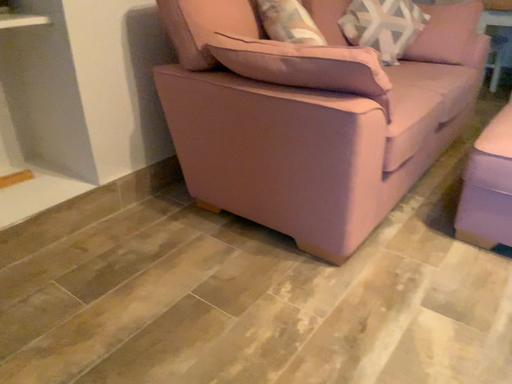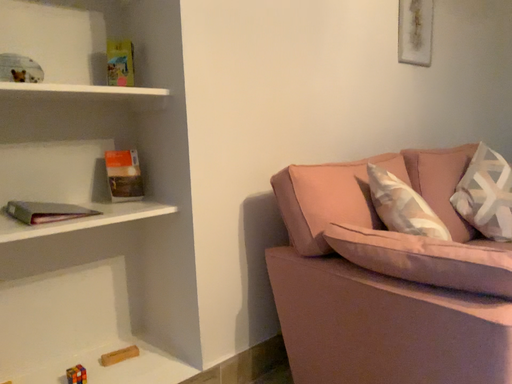
Question: How did the camera likely rotate when shooting the video?

Choices:
 (A) rotated upward
 (B) rotated downward

Answer: (A)